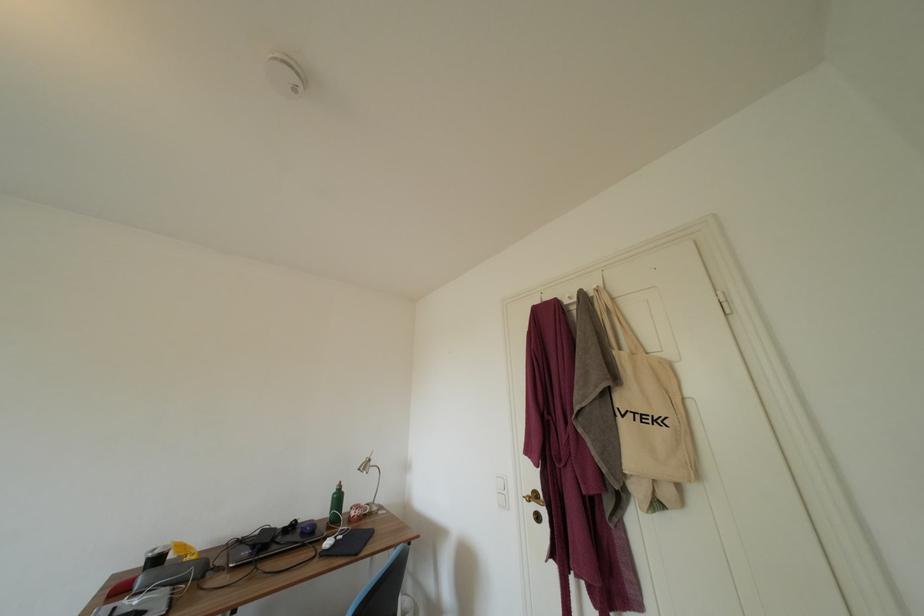
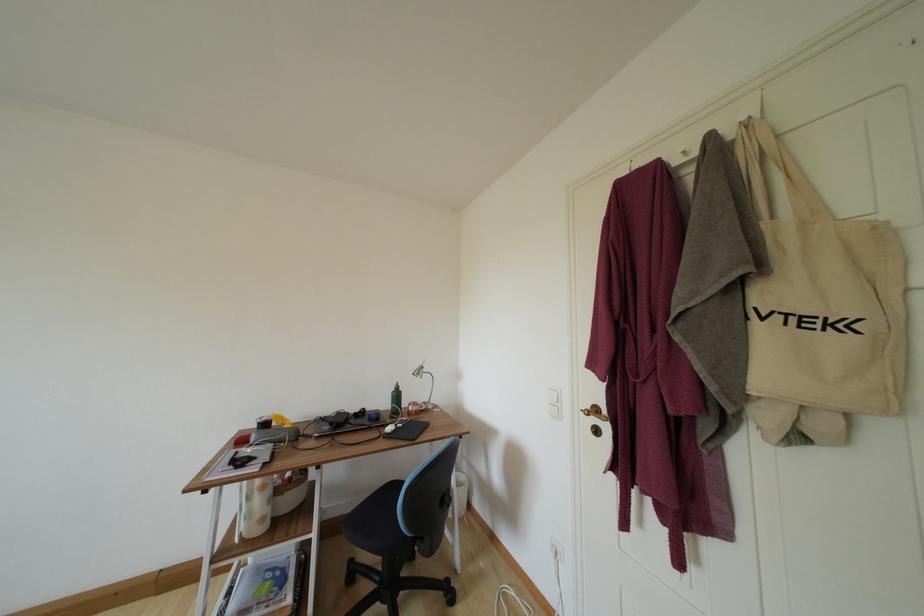
Find the pixel in the second image that matches pixel 535 501 in the first image.

(593, 416)